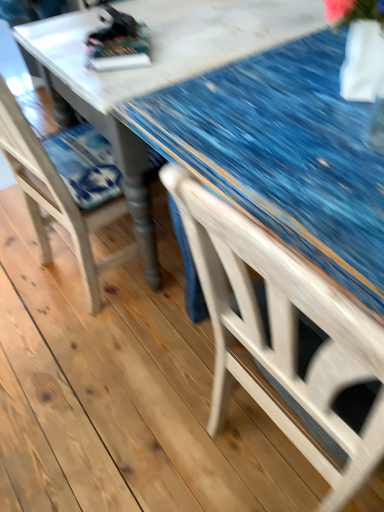
Question: Should I look upward or downward to see blue fabric-covered table at center?

Choices:
 (A) up
 (B) down

Answer: (A)

Question: Is blue fabric-covered table at center behind wooden chair at left?

Choices:
 (A) no
 (B) yes

Answer: (B)

Question: Does blue fabric-covered table at center have a smaller size compared to wooden chair at left?

Choices:
 (A) yes
 (B) no

Answer: (B)

Question: From a real-world perspective, is blue fabric-covered table at center on wooden chair at left?

Choices:
 (A) no
 (B) yes

Answer: (A)

Question: Considering the relative sizes of blue fabric-covered table at center and wooden chair at left in the image provided, is blue fabric-covered table at center thinner than wooden chair at left?

Choices:
 (A) no
 (B) yes

Answer: (A)

Question: Does blue fabric-covered table at center appear on the left side of wooden chair at left?

Choices:
 (A) yes
 (B) no

Answer: (B)

Question: Is blue fabric-covered table at center looking in the opposite direction of wooden chair at left?

Choices:
 (A) yes
 (B) no

Answer: (A)

Question: From the image's perspective, is wooden chair at left beneath blue fabric-covered table at center?

Choices:
 (A) no
 (B) yes

Answer: (B)

Question: Considering the relative sizes of wooden chair at left and blue fabric-covered table at center in the image provided, is wooden chair at left smaller than blue fabric-covered table at center?

Choices:
 (A) yes
 (B) no

Answer: (A)

Question: Is wooden chair at left positioned with its back to blue fabric-covered table at center?

Choices:
 (A) no
 (B) yes

Answer: (B)

Question: Considering the relative positions of wooden chair at left and blue fabric-covered table at center in the image provided, is wooden chair at left behind blue fabric-covered table at center?

Choices:
 (A) no
 (B) yes

Answer: (A)

Question: From a real-world perspective, is wooden chair at left positioned over blue fabric-covered table at center based on gravity?

Choices:
 (A) yes
 (B) no

Answer: (A)

Question: Is wooden chair at left completely or partially outside of blue fabric-covered table at center?

Choices:
 (A) yes
 (B) no

Answer: (B)

Question: Is wooden chair at left situated inside blue fabric-covered table at center or outside?

Choices:
 (A) outside
 (B) inside

Answer: (B)